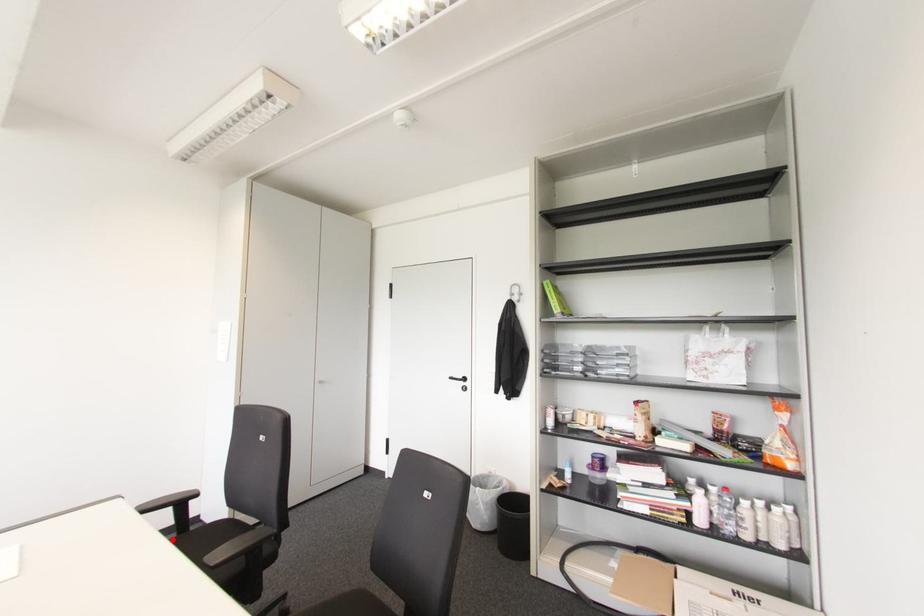
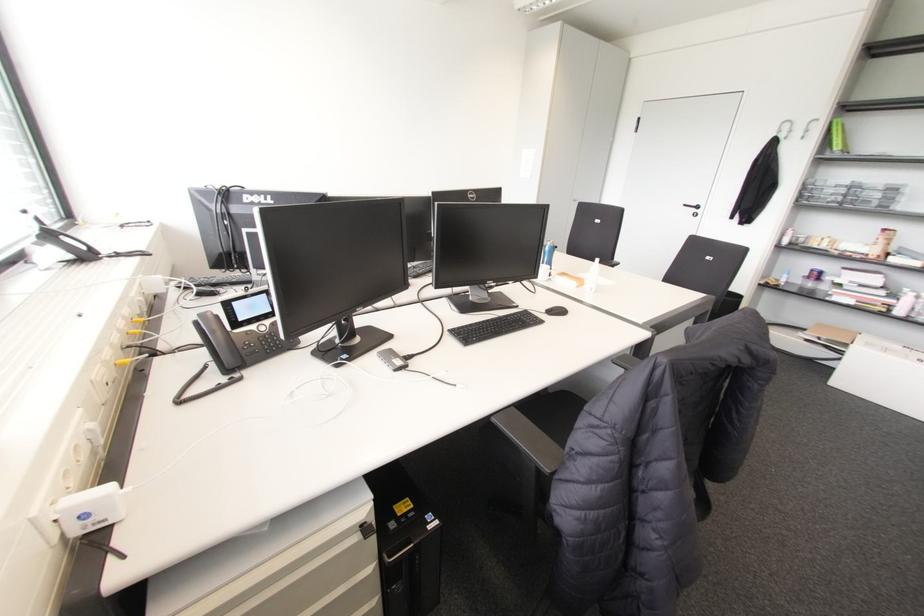
Question: I am providing you with two images of the same scene from different viewpoints. A red point is marked on the first image. Is the red point's position out of view in image 2?

Choices:
 (A) Yes
 (B) No

Answer: (A)